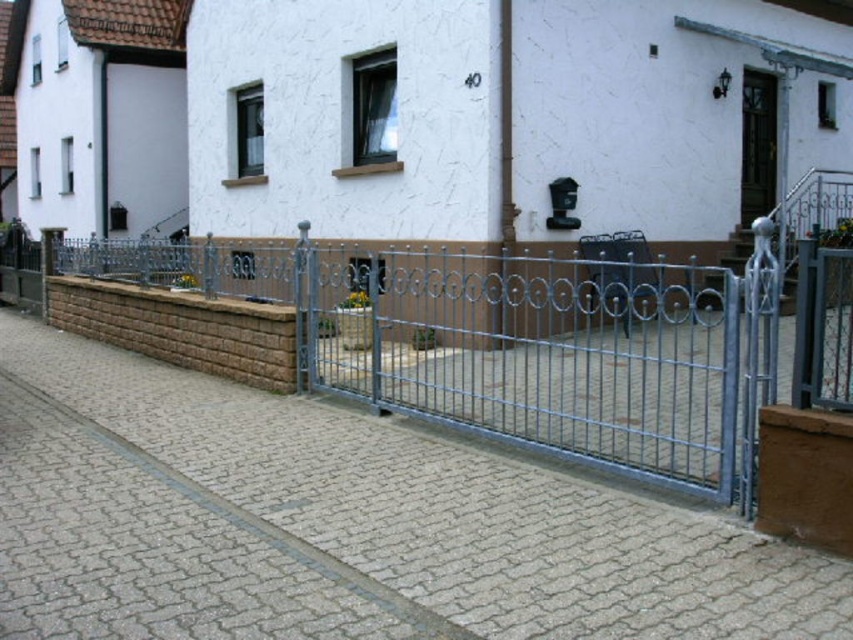
You are a delivery person standing at the sidewalk in front of the house. You need to deliver a package to the brown wooden door at upper right. The gate is partially open. Can you walk through the silver metallic gate at center to reach the door?

The silver metallic gate at center is 4.27 meters from the brown wooden door at upper right. Since the gate is partially open, you can walk through the silver metallic gate at center to reach the brown wooden door at upper right.

In the scene shown: You are a delivery person trying to reach the brown wooden door at upper right. The silver metallic gate at center is blocking your path. Can you walk through the gate to reach the door?

The silver metallic gate at center is in front of the brown wooden door at upper right, so you can walk through the gate to reach the door since it is the path leading to it.

You are a delivery person approaching the property and need to reach the brown wooden door at upper right. The silver metallic gate at center is partially open. Can you walk through the gate to reach the door?

The silver metallic gate at center is positioned under the brown wooden door at upper right, meaning the door is above the gate. Since the gate is partially open, you can walk through the gate to reach the brown wooden door at upper right as it is accessible from that path.